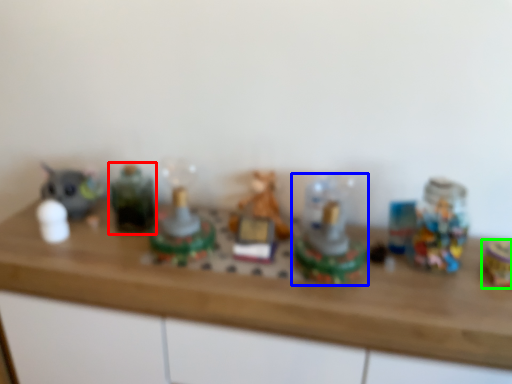
Question: Based on their relative distances, which object is nearer to toy (highlighted by a red box)? Choose from toy (highlighted by a blue box) and toy (highlighted by a green box).

Choices:
 (A) toy
 (B) toy

Answer: (A)